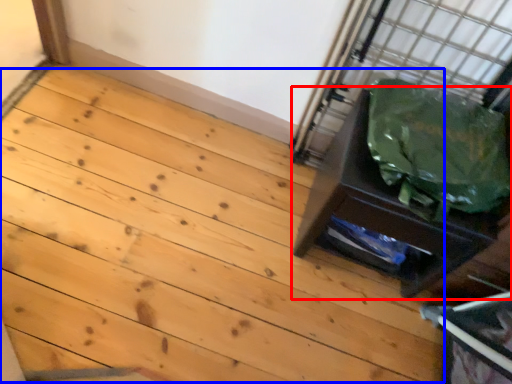
Question: Which object is further to the camera taking this photo, furniture (highlighted by a red box) or stairwell (highlighted by a blue box)?

Choices:
 (A) furniture
 (B) stairwell

Answer: (A)